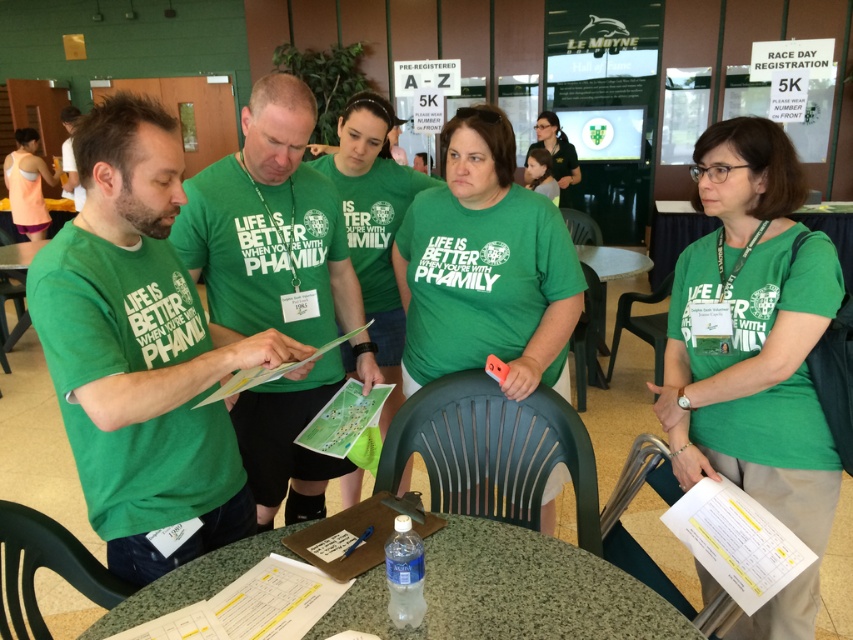
Question: Which object is farther from the camera taking this photo?

Choices:
 (A) matte green t-shirt at center
 (B) white plastic table at lower center

Answer: (B)

Question: Can you confirm if green matte shirt at center is positioned above green plastic table at center?

Choices:
 (A) no
 (B) yes

Answer: (B)

Question: Estimate the real-world distances between objects in this image. Which object is closer to the white plastic table at lower center?

Choices:
 (A) matte green t-shirt at center
 (B) green plastic table at center
 (C) green matte shirt at center

Answer: (A)

Question: Is green matte shirt at center thinner than white plastic table at lower center?

Choices:
 (A) no
 (B) yes

Answer: (B)

Question: Is matte green t-shirt at center thinner than orange tank top at left?

Choices:
 (A) no
 (B) yes

Answer: (B)

Question: Among these points, which one is nearest to the camera?

Choices:
 (A) (619, 266)
 (B) (9, 168)

Answer: (A)